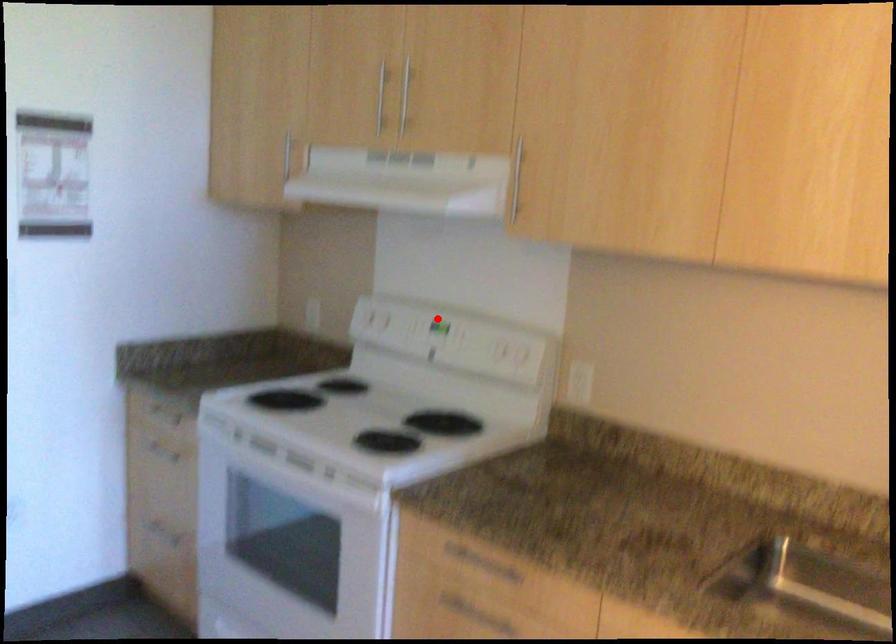
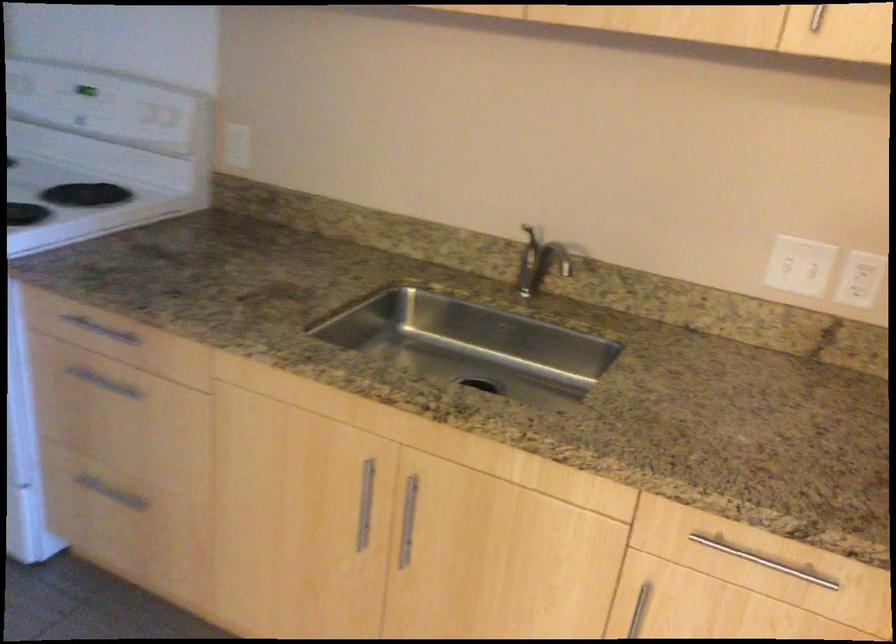
Question: I am providing you with two images of the same scene from different viewpoints. A red point is marked on the first image. Is the red point's position out of view in image 2?

Choices:
 (A) Yes
 (B) No

Answer: (B)